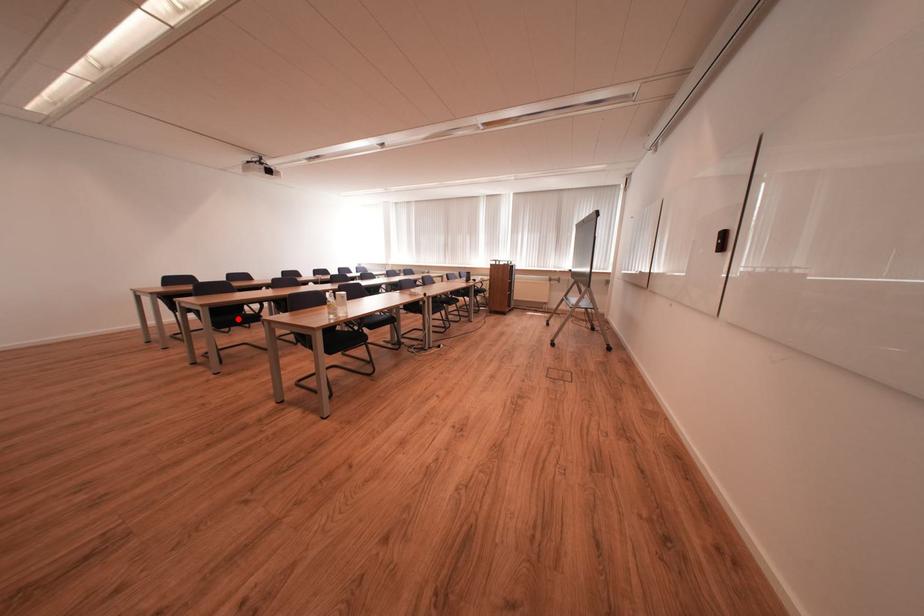
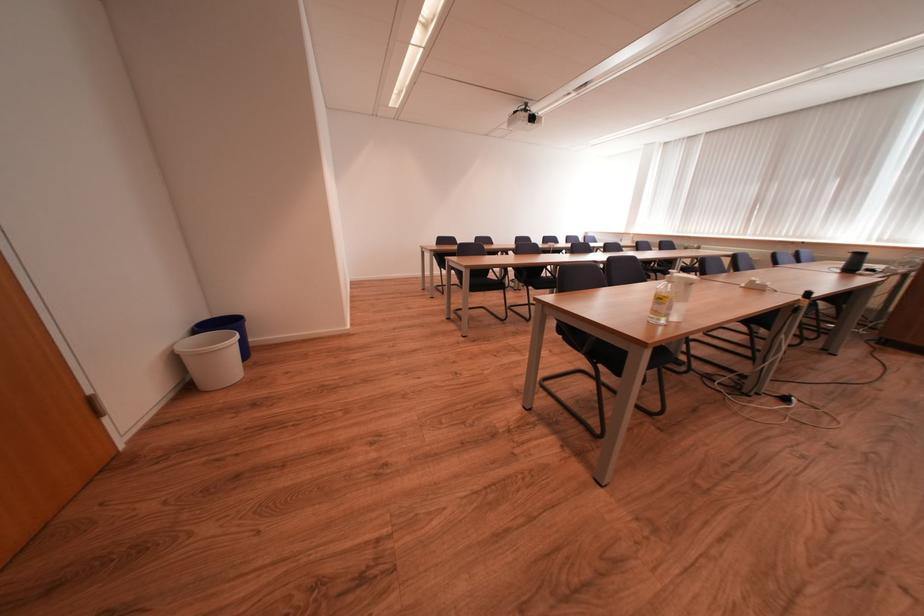
In the second image, find the point that corresponds to the highlighted location in the first image.

(489, 283)